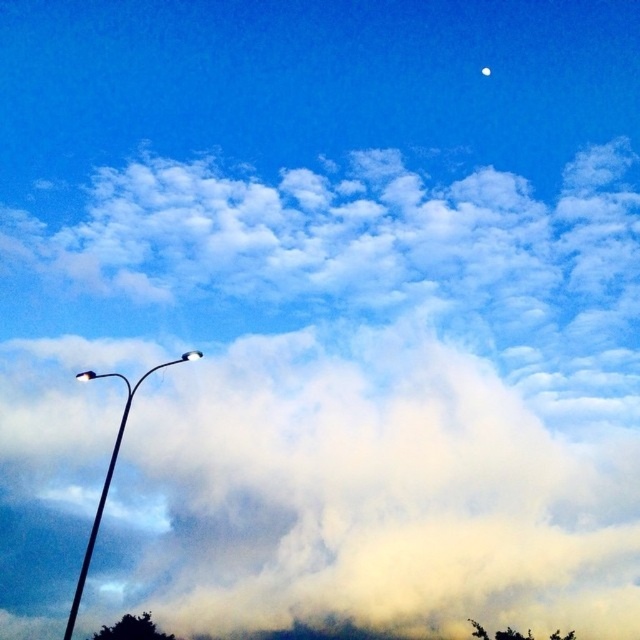
Question: Is metallic street light at left wider than white glossy moon at upper center?

Choices:
 (A) no
 (B) yes

Answer: (B)

Question: Does metallic street light at left appear under white glossy moon at upper center?

Choices:
 (A) no
 (B) yes

Answer: (B)

Question: Is metallic street light at left bigger than white glossy moon at upper center?

Choices:
 (A) no
 (B) yes

Answer: (B)

Question: Which point appears farthest from the camera in this image?

Choices:
 (A) (88, 541)
 (B) (488, 70)
 (C) (120, 436)

Answer: (B)

Question: Which is farther from the metallic street light at left?

Choices:
 (A) metallic pole at left
 (B) white glossy moon at upper center

Answer: (B)

Question: Which of the following is the farthest from the observer?

Choices:
 (A) metallic street light at left
 (B) metallic pole at left
 (C) white glossy moon at upper center

Answer: (C)